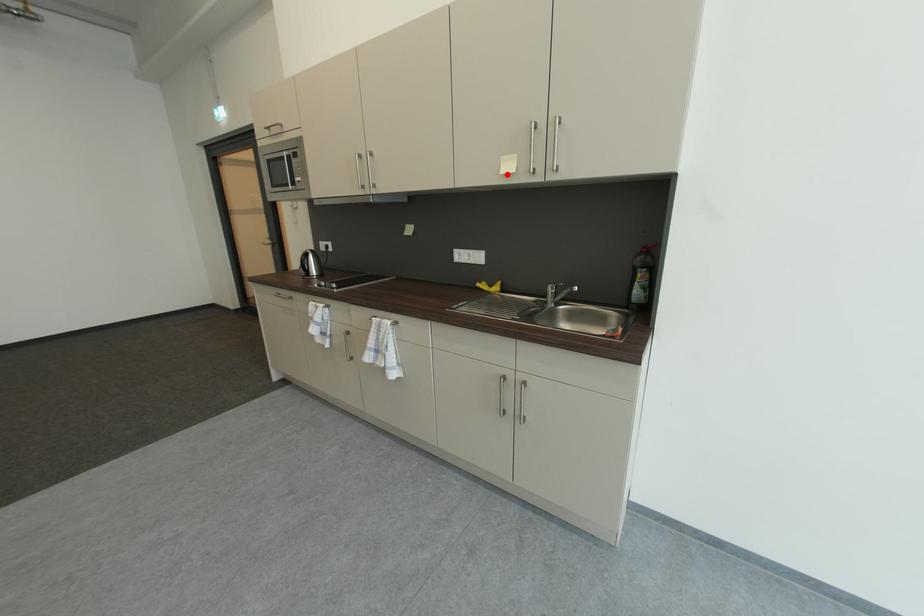
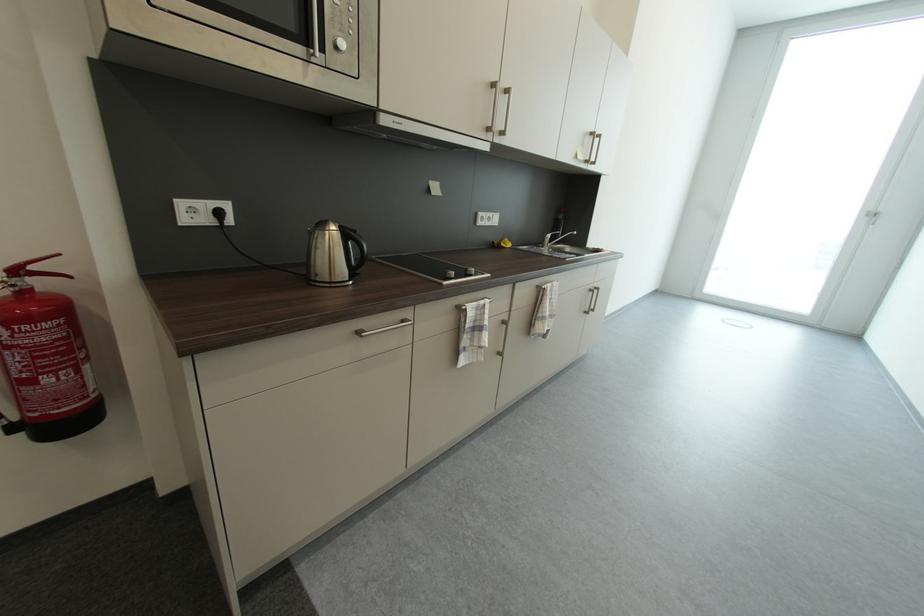
Where in the second image is the point corresponding to the highlighted location from the first image?

(585, 160)